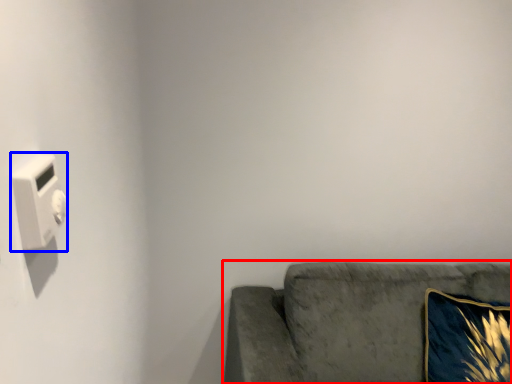
Question: Which of the following is the closest to the observer, studio couch (highlighted by a red box) or light switch (highlighted by a blue box)?

Choices:
 (A) studio couch
 (B) light switch

Answer: (B)